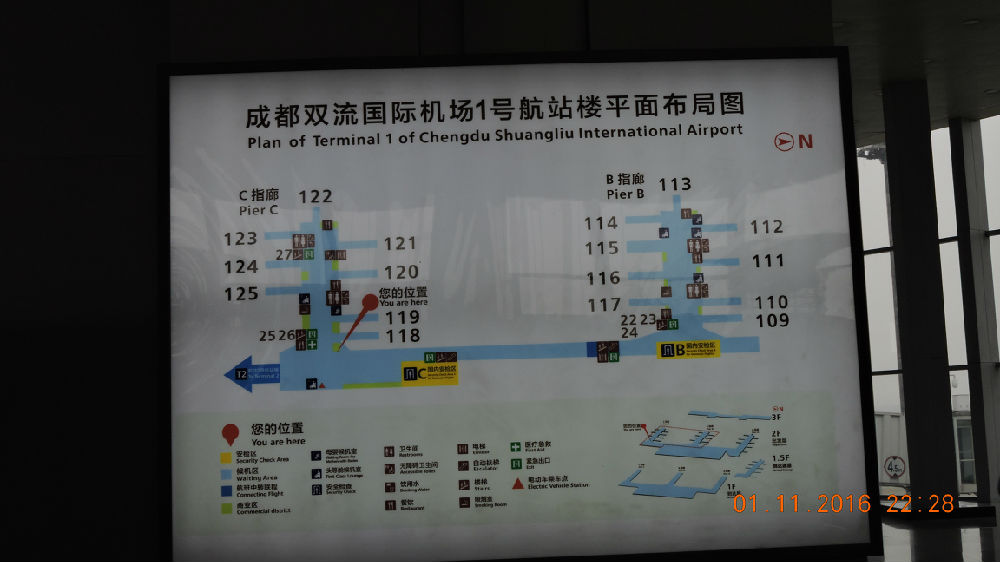
Identify the location of window. This screenshot has width=1000, height=562. (875, 299), (863, 221), (878, 415), (963, 409), (958, 310), (944, 213), (993, 189), (992, 255).